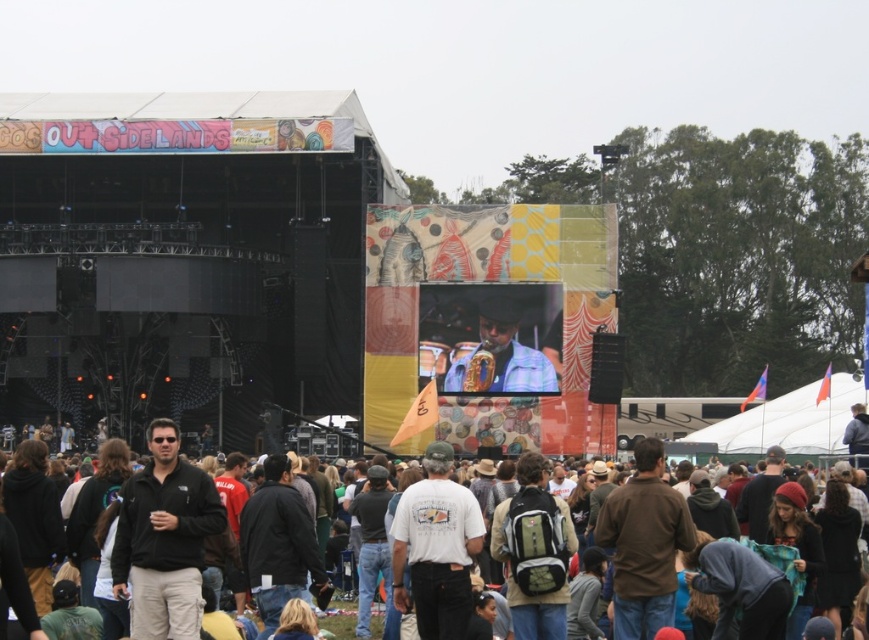
This screenshot has width=869, height=640. What do you see at coordinates (164, 540) in the screenshot? I see `black matte jacket at center` at bounding box center [164, 540].

Between point (176, 529) and point (204, 634), which one is positioned behind?

The point (176, 529) is more distant.

The height and width of the screenshot is (640, 869). Describe the element at coordinates (164, 540) in the screenshot. I see `black matte jacket at center` at that location.

Identify the location of black matte jacket at center. Image resolution: width=869 pixels, height=640 pixels. (164, 540).

This screenshot has height=640, width=869. Describe the element at coordinates (164, 540) in the screenshot. I see `black matte jacket at center` at that location.

Who is more distant from viewer, (x=160, y=428) or (x=456, y=384)?

The point (x=456, y=384) is behind.

Who is more forward, (184, 528) or (516, 323)?

Point (184, 528)

Image resolution: width=869 pixels, height=640 pixels. Find the location of `black matte jacket at center`. black matte jacket at center is located at coordinates (164, 540).

Does matte blue shirt at center appear over black jacket at center?

Correct, matte blue shirt at center is located above black jacket at center.

Does matte blue shirt at center come in front of black jacket at center?

No.

Between point (462, 381) and point (342, 620), which one is positioned behind?

Positioned behind is point (462, 381).

The image size is (869, 640). What are the coordinates of `matte blue shirt at center` in the screenshot? It's located at (503, 355).